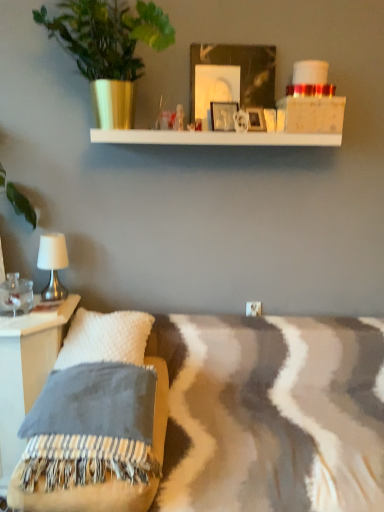
Question: Is the position of green leafy plant in gold pot at upper left more distant than that of silver metallic table lamp at left?

Choices:
 (A) no
 (B) yes

Answer: (A)

Question: Is green leafy plant in gold pot at upper left thinner than silver metallic table lamp at left?

Choices:
 (A) no
 (B) yes

Answer: (A)

Question: Can you confirm if green leafy plant in gold pot at upper left is positioned to the right of silver metallic table lamp at left?

Choices:
 (A) yes
 (B) no

Answer: (A)

Question: Is green leafy plant in gold pot at upper left closer to the viewer compared to silver metallic table lamp at left?

Choices:
 (A) yes
 (B) no

Answer: (A)

Question: Is green leafy plant in gold pot at upper left shorter than silver metallic table lamp at left?

Choices:
 (A) no
 (B) yes

Answer: (A)

Question: In terms of size, does metallic silver picture frame at upper center, the first picture frame from the left, appear bigger or smaller than metallic silver picture frame at upper center, the first picture frame viewed from the right?

Choices:
 (A) big
 (B) small

Answer: (A)

Question: Is metallic silver picture frame at upper center, the first picture frame from the left, taller or shorter than metallic silver picture frame at upper center, the first picture frame viewed from the right?

Choices:
 (A) tall
 (B) short

Answer: (A)

Question: In the image, is metallic silver picture frame at upper center, marked as the second picture frame in a right-to-left arrangement, positioned in front of or behind metallic silver picture frame at upper center, which appears as the 2th picture frame when viewed from the left?

Choices:
 (A) behind
 (B) front

Answer: (B)

Question: Is point (231, 102) positioned closer to the camera than point (253, 109)?

Choices:
 (A) closer
 (B) farther

Answer: (B)

Question: Looking at the image, does metallic silver picture frame at upper center, the first picture frame from the left, seem bigger or smaller compared to silver metallic table lamp at left?

Choices:
 (A) big
 (B) small

Answer: (B)

Question: In the image, is metallic silver picture frame at upper center, marked as the second picture frame in a right-to-left arrangement, on the left side or the right side of silver metallic table lamp at left?

Choices:
 (A) left
 (B) right

Answer: (B)

Question: From their relative heights in the image, would you say metallic silver picture frame at upper center, the first picture frame from the left, is taller or shorter than silver metallic table lamp at left?

Choices:
 (A) tall
 (B) short

Answer: (B)

Question: From the image's perspective, is metallic silver picture frame at upper center, the first picture frame from the left, positioned above or below silver metallic table lamp at left?

Choices:
 (A) below
 (B) above

Answer: (B)

Question: In terms of height, does green leafy plant in gold pot at upper left look taller or shorter compared to metallic silver picture frame at upper center, marked as the second picture frame in a right-to-left arrangement?

Choices:
 (A) short
 (B) tall

Answer: (B)

Question: Is green leafy plant in gold pot at upper left spatially inside metallic silver picture frame at upper center, marked as the second picture frame in a right-to-left arrangement, or outside of it?

Choices:
 (A) outside
 (B) inside

Answer: (A)